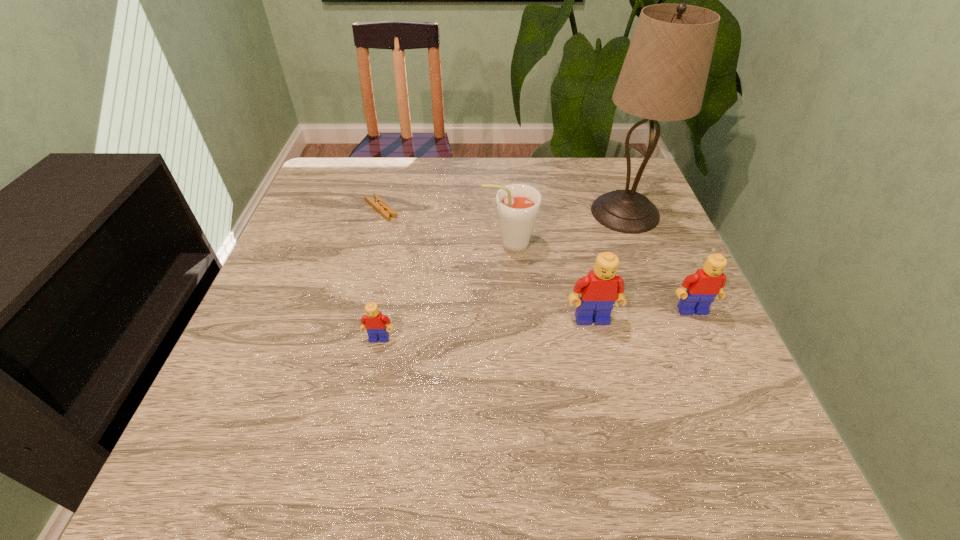
Locate an element on the screen. The height and width of the screenshot is (540, 960). the fifth tallest object is located at coordinates (374, 322).

I want to click on the shortest Lego, so click(374, 322).

Locate an element on the screen. The width and height of the screenshot is (960, 540). the fourth object from left to right is located at coordinates (601, 288).

At what (x,y) coordinates should I click in order to perform the action: click on the rightmost Lego. Please return your answer as a coordinate pair (x, y). Looking at the image, I should click on (707, 283).

Identify the location of the third shortest object. The image size is (960, 540). (707, 283).

You are a GUI agent. You are given a task and a screenshot of the screen. Output one action in this format:
    pyautogui.click(x=<x>, y=<y>)
    Task: Click on the root beer
    
    Given the screenshot: What is the action you would take?
    pyautogui.click(x=517, y=205)

Where is `lampshade`? The height and width of the screenshot is (540, 960). lampshade is located at coordinates (663, 78).

Find the location of a particular element. the shortest object is located at coordinates (386, 211).

Find the location of a particular element. vacant space located on the face of the nearest object is located at coordinates (363, 422).

I want to click on blank space located 0.180m on the face of the third object from right to left, so click(613, 410).